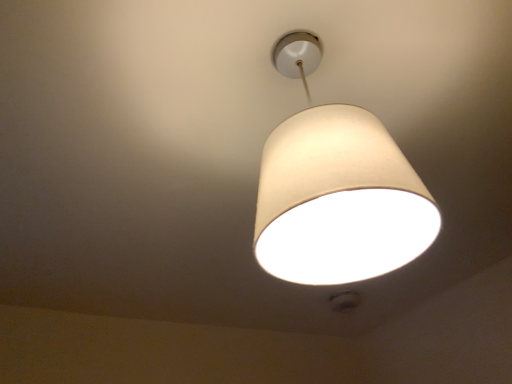
Describe the element at coordinates (339, 200) in the screenshot. I see `white fabric lampshade at center` at that location.

Where is `white fabric lampshade at center`? This screenshot has width=512, height=384. white fabric lampshade at center is located at coordinates pyautogui.click(x=339, y=200).

You are a GUI agent. You are given a task and a screenshot of the screen. Output one action in this format:
    pyautogui.click(x=<x>, y=<y>)
    Task: Click on the white fabric lampshade at center
    
    Given the screenshot: What is the action you would take?
    pyautogui.click(x=339, y=200)